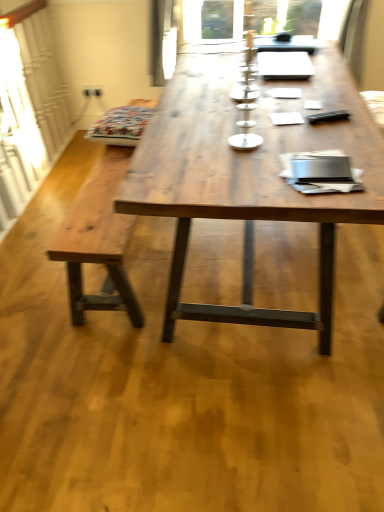
Question: Is patterned fabric cushion at left not within wooden table at center?

Choices:
 (A) yes
 (B) no

Answer: (A)

Question: Considering the relative sizes of patterned fabric cushion at left and wooden table at center in the image provided, is patterned fabric cushion at left wider than wooden table at center?

Choices:
 (A) no
 (B) yes

Answer: (A)

Question: Is patterned fabric cushion at left thinner than wooden table at center?

Choices:
 (A) yes
 (B) no

Answer: (A)

Question: Is patterned fabric cushion at left shorter than wooden table at center?

Choices:
 (A) yes
 (B) no

Answer: (A)

Question: Is patterned fabric cushion at left turned away from wooden table at center?

Choices:
 (A) yes
 (B) no

Answer: (A)

Question: Is patterned fabric cushion at left spatially inside wooden bench at left, or outside of it?

Choices:
 (A) inside
 (B) outside

Answer: (B)

Question: From a real-world perspective, is patterned fabric cushion at left above or below wooden bench at left?

Choices:
 (A) below
 (B) above

Answer: (B)

Question: Relative to wooden bench at left, is patterned fabric cushion at left in front or behind?

Choices:
 (A) front
 (B) behind

Answer: (B)

Question: Is patterned fabric cushion at left to the left or to the right of wooden bench at left in the image?

Choices:
 (A) left
 (B) right

Answer: (A)

Question: Is point (105, 172) positioned closer to the camera than point (248, 295)?

Choices:
 (A) farther
 (B) closer

Answer: (A)

Question: In terms of size, does wooden bench at left appear bigger or smaller than wooden table at center?

Choices:
 (A) big
 (B) small

Answer: (B)

Question: Choose the correct answer: Is wooden bench at left inside wooden table at center or outside it?

Choices:
 (A) outside
 (B) inside

Answer: (A)

Question: From the image's perspective, is wooden bench at left above or below wooden table at center?

Choices:
 (A) below
 (B) above

Answer: (A)

Question: Based on their positions, is patterned fabric cushion at left located to the left or right of wooden table at center?

Choices:
 (A) left
 (B) right

Answer: (A)

Question: Does point (102, 117) appear closer or farther from the camera than point (309, 137)?

Choices:
 (A) closer
 (B) farther

Answer: (B)